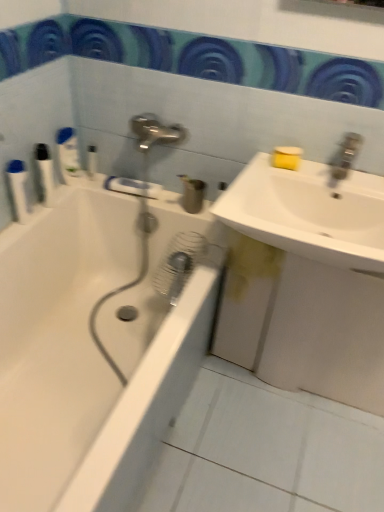
Where is `free point to the right of white plastic bottle at upper left, the fourth toiletry positioned from the left`? This screenshot has height=512, width=384. free point to the right of white plastic bottle at upper left, the fourth toiletry positioned from the left is located at coordinates (129, 188).